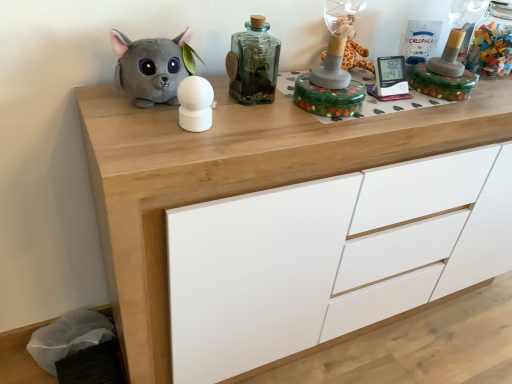
Question: Is white matte sphere at center, which is the 2th toy from right to left, to the left of translucent glass bottle at center, the 2th bottle when ordered from back to front, from the viewer's perspective?

Choices:
 (A) no
 (B) yes

Answer: (B)

Question: From the image's perspective, would you say white matte sphere at center, which is the 2th toy from right to left, is positioned over translucent glass bottle at center, the first bottle when ordered from left to right?

Choices:
 (A) yes
 (B) no

Answer: (B)

Question: From the image's perspective, is white matte sphere at center, which is the 2th toy from right to left, located beneath translucent glass bottle at center, the 2th bottle when ordered from back to front?

Choices:
 (A) no
 (B) yes

Answer: (B)

Question: Is white matte sphere at center, which is the 2th toy from right to left, shorter than translucent glass bottle at center, marked as the second bottle in a right-to-left arrangement?

Choices:
 (A) yes
 (B) no

Answer: (A)

Question: Can you confirm if white matte sphere at center, the 2th toy from the left, is taller than translucent glass bottle at center, the 1th bottle positioned from the front?

Choices:
 (A) no
 (B) yes

Answer: (A)

Question: Is white matte sphere at center, the 2th toy from the left, not within translucent glass bottle at center, marked as the second bottle in a right-to-left arrangement?

Choices:
 (A) no
 (B) yes

Answer: (B)

Question: Is translucent glass bottle at center, the first bottle when ordered from left to right, positioned with its back to wooden chest of drawers at center?

Choices:
 (A) yes
 (B) no

Answer: (B)

Question: Does translucent glass bottle at center, the 1th bottle positioned from the front, have a lesser width compared to wooden chest of drawers at center?

Choices:
 (A) no
 (B) yes

Answer: (B)

Question: Is the position of translucent glass bottle at center, marked as the second bottle in a right-to-left arrangement, more distant than that of wooden chest of drawers at center?

Choices:
 (A) yes
 (B) no

Answer: (A)

Question: From a real-world perspective, is translucent glass bottle at center, marked as the second bottle in a right-to-left arrangement, physically below wooden chest of drawers at center?

Choices:
 (A) no
 (B) yes

Answer: (A)

Question: Is translucent glass bottle at center, the 2th bottle when ordered from back to front, to the right of wooden chest of drawers at center from the viewer's perspective?

Choices:
 (A) yes
 (B) no

Answer: (B)

Question: Is translucent glass bottle at center, marked as the second bottle in a right-to-left arrangement, positioned in front of wooden chest of drawers at center?

Choices:
 (A) no
 (B) yes

Answer: (A)

Question: Does gray plush toy at left, which ranks as the 1th toy in left-to-right order, have a greater height compared to wooden chest of drawers at center?

Choices:
 (A) yes
 (B) no

Answer: (B)